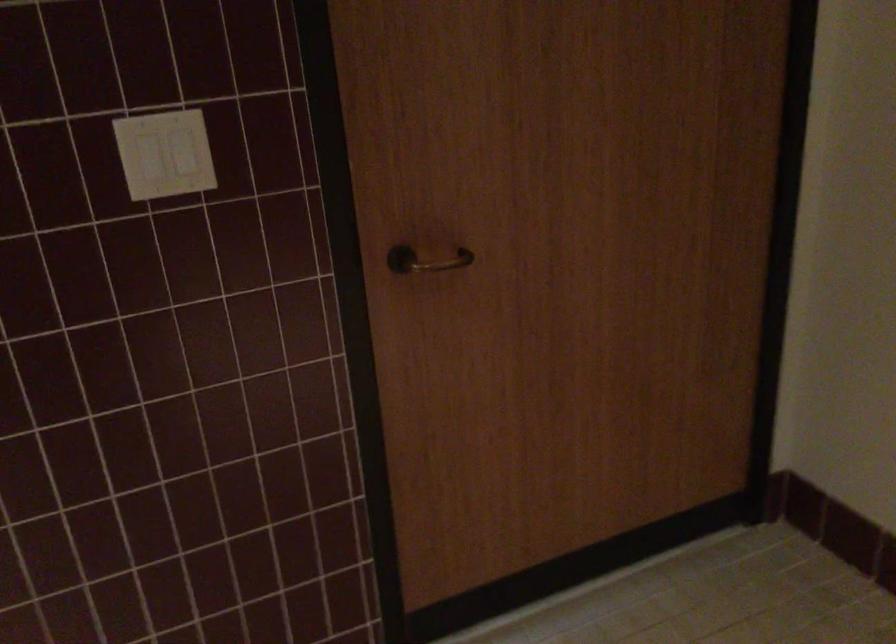
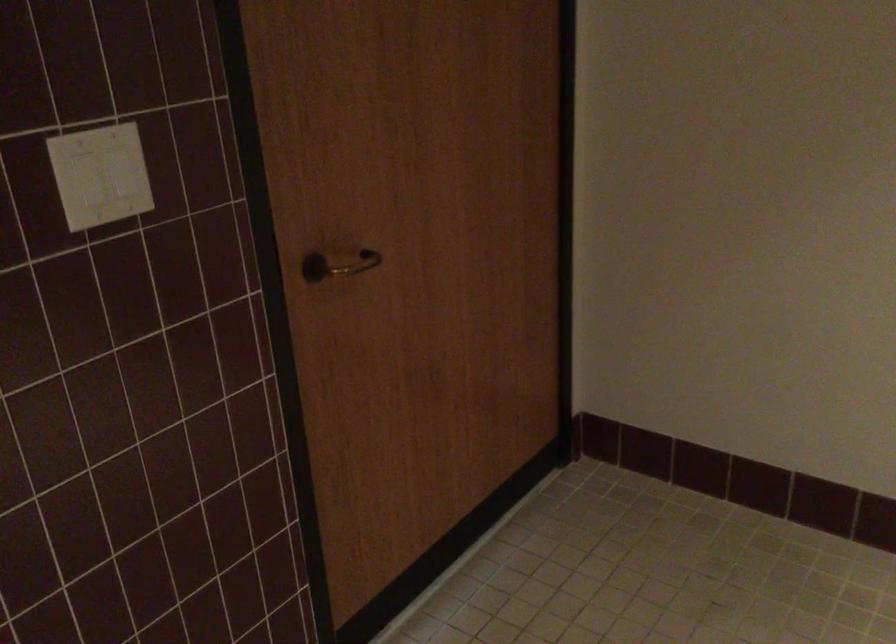
Question: Based on the continuous images, in which direction is the camera rotating? Reply with the corresponding letter.

Choices:
 (A) Left
 (B) Right
 (C) Up
 (D) Down

Answer: (B)